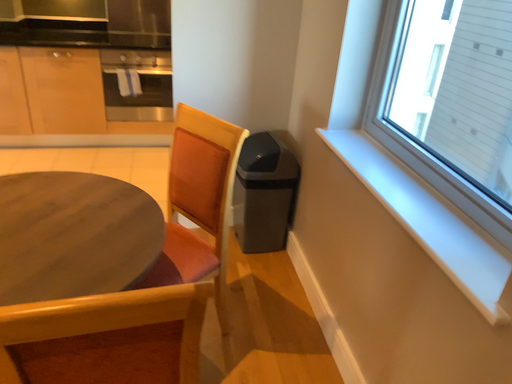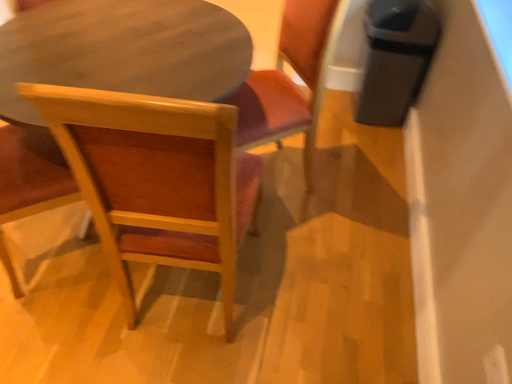
Question: Which way did the camera rotate in the video?

Choices:
 (A) rotated left
 (B) rotated right

Answer: (A)